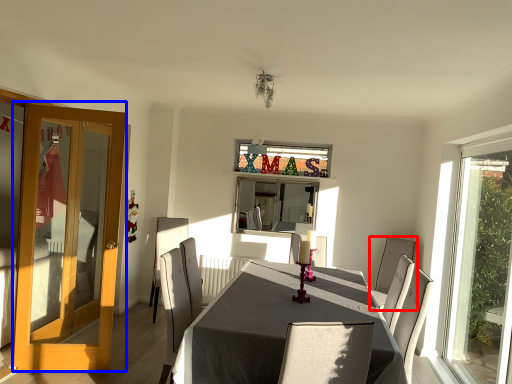
Question: Which object appears farthest to the camera in this image, chair (highlighted by a red box) or door (highlighted by a blue box)?

Choices:
 (A) chair
 (B) door

Answer: (A)